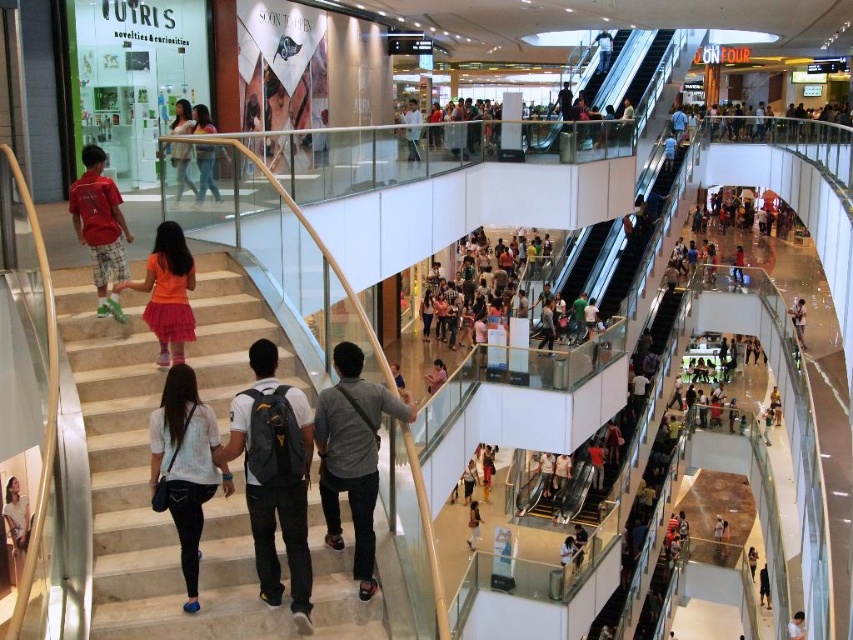
You are a delivery robot with a maximum delivery range of 30 meters. You are currently positioned near the dark gray backpack at center and need to deliver a package to the matte pink dress at center. Can you complete the delivery without needing to recharge?

The distance between the dark gray backpack at center and the matte pink dress at center is 29.19 meters, which is within your 30 meter range. Yes, you can complete the delivery without needing to recharge.